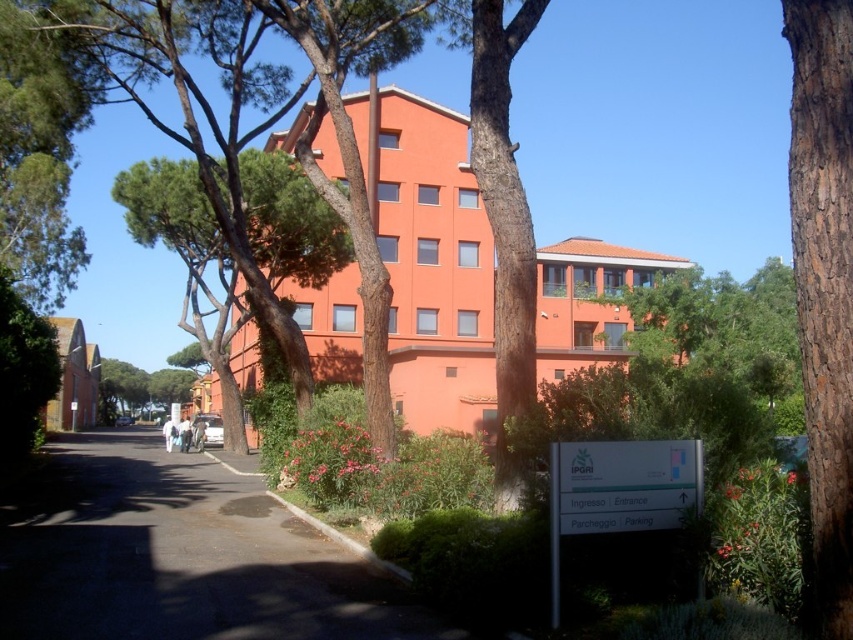
Is point (525, 385) less distant than point (670, 513)?

That is False.

Can you confirm if brown rough bark tree at center is smaller than white plastic sign at lower right?

No.

Is point (502, 268) more distant than point (631, 525)?

That is True.

The image size is (853, 640). What are the coordinates of `brown rough bark tree at center` in the screenshot? It's located at (503, 227).

Is point (265, 168) in front of point (524, 275)?

No, it is behind (524, 275).

Does green rough bark tree at center appear on the right side of brown rough bark tree at center?

In fact, green rough bark tree at center is to the left of brown rough bark tree at center.

Is point (241, 179) closer to viewer compared to point (482, 92)?

That is False.

Image resolution: width=853 pixels, height=640 pixels. What are the coordinates of `green rough bark tree at center` in the screenshot? It's located at (190, 260).

Measure the distance from green rough bark tree at center to white plastic sign at lower right.

18.28 meters

Is green rough bark tree at center closer to camera compared to white plastic sign at lower right?

No, it is not.

Who is more distant from viewer, (x=161, y=202) or (x=608, y=528)?

The point (x=161, y=202) is more distant.

You are a GUI agent. You are given a task and a screenshot of the screen. Output one action in this format:
    pyautogui.click(x=<x>, y=<y>)
    Task: Click on the green rough bark tree at center
    The width and height of the screenshot is (853, 640).
    Given the screenshot: What is the action you would take?
    pyautogui.click(x=190, y=260)